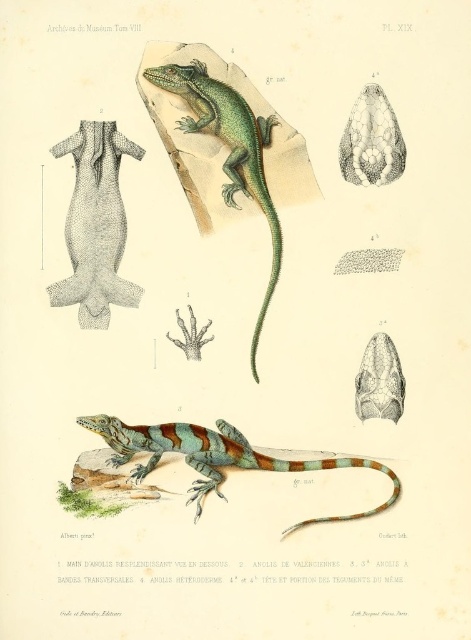
In the scientific illustration from the Museum Tom VIII, there is a gray textured tail at center and a multicolored painted lizard at center. Which of these two objects has a greater width?

The multicolored painted lizard at center has a greater width than the gray textured tail at center.

Looking at the scientific illustration of the lizard, where is the gray textured tail at center in relation to the multicolored painted lizard at center?

The gray textured tail at center is positioned on the left side of multicolored painted lizard at center.

In the scene shown: Based on the provided scene description, can you determine which lizard is placed higher between the multicolored painted lizard at center and the green glossy lizard at upper center?

The green glossy lizard at upper center is placed higher because the multicolored painted lizard at center is positioned under it.